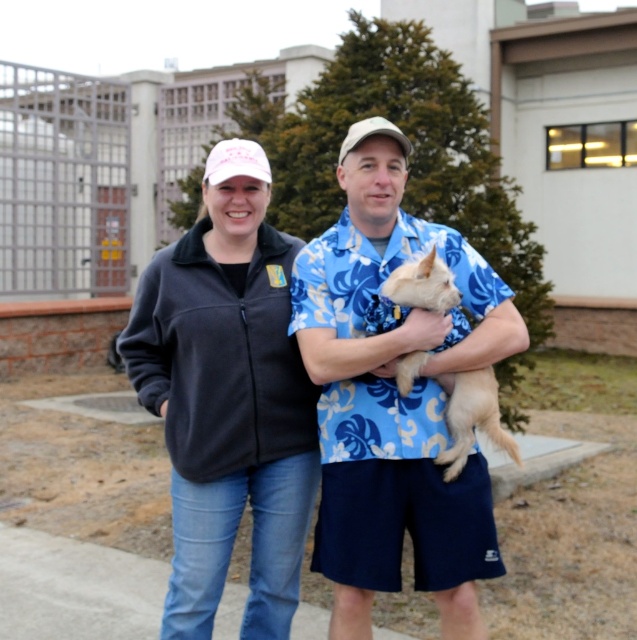
Question: Does matte black jacket at center have a smaller size compared to fuzzy beige dog at center?

Choices:
 (A) no
 (B) yes

Answer: (A)

Question: Where is black fleece jacket at center located in relation to fuzzy beige dog at center in the image?

Choices:
 (A) right
 (B) left

Answer: (B)

Question: Which point appears closest to the camera in this image?

Choices:
 (A) (262, 284)
 (B) (438, 248)

Answer: (B)

Question: Is matte black jacket at center behind fuzzy beige dog at center?

Choices:
 (A) yes
 (B) no

Answer: (A)

Question: Which of the following is the farthest from the observer?

Choices:
 (A) (222, 438)
 (B) (347, 304)
 (C) (454, 417)

Answer: (A)

Question: Which object is positioned farthest from the fuzzy beige dog at center?

Choices:
 (A) matte black jacket at center
 (B) black fleece jacket at center

Answer: (B)